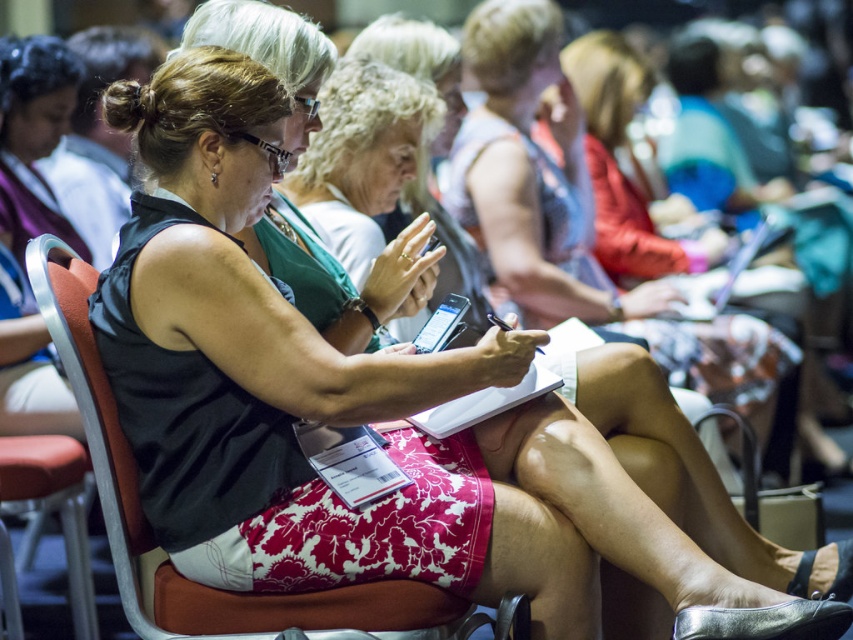
Question: Can you confirm if pink floral skirt at center is thinner than red fabric chair at center?

Choices:
 (A) yes
 (B) no

Answer: (A)

Question: Which object is farther from the camera taking this photo?

Choices:
 (A) red fabric chair at center
 (B) pink floral skirt at center

Answer: (B)

Question: Considering the relative positions of pink floral skirt at center and red fabric chair at center in the image provided, where is pink floral skirt at center located with respect to red fabric chair at center?

Choices:
 (A) left
 (B) right

Answer: (B)

Question: Can you confirm if pink floral skirt at center is positioned below red fabric chair at center?

Choices:
 (A) yes
 (B) no

Answer: (B)